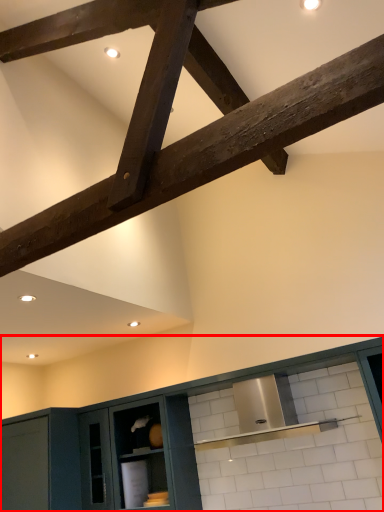
Question: Where is cabinetry (annotated by the red box) located in relation to beam in the image?

Choices:
 (A) right
 (B) left

Answer: (A)